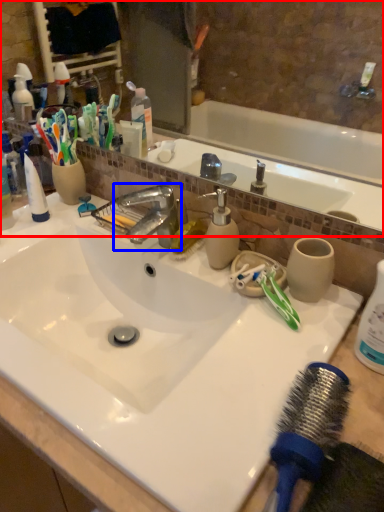
Question: Which of the following is the farthest to the observer, mirror (highlighted by a red box) or tap (highlighted by a blue box)?

Choices:
 (A) mirror
 (B) tap

Answer: (B)